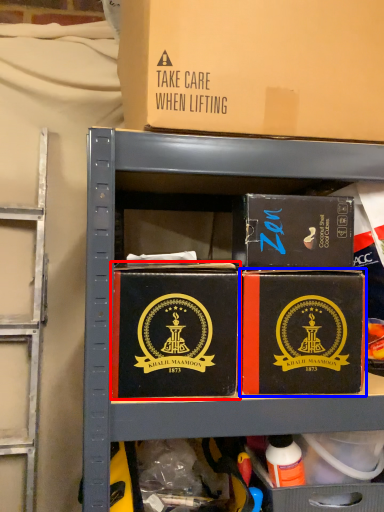
Question: Which of the following is the farthest to the observer, box (highlighted by a red box) or box (highlighted by a blue box)?

Choices:
 (A) box
 (B) box

Answer: (B)